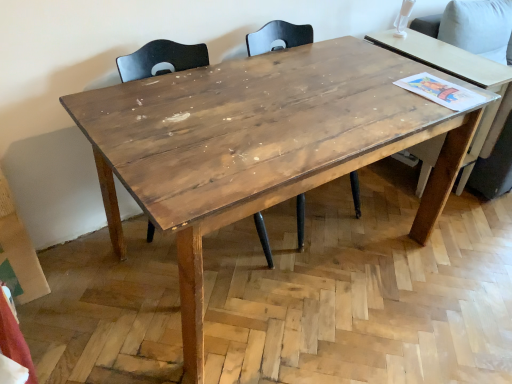
Describe the element at coordinates (459, 78) in the screenshot. I see `wooden table at right` at that location.

At what (x,y) coordinates should I click in order to perform the action: click on wooden chair at center, arranged as the 1th chair when viewed from the left. Please return your answer as a coordinate pair (x, y). The width and height of the screenshot is (512, 384). Looking at the image, I should click on (161, 59).

Considering the relative positions of wooden table at right and wooden chair at center, which appears as the second chair when viewed from the right, in the image provided, is wooden table at right to the right of wooden chair at center, which appears as the second chair when viewed from the right, from the viewer's perspective?

Indeed, wooden table at right is positioned on the right side of wooden chair at center, which appears as the second chair when viewed from the right.

Considering the relative sizes of wooden table at right and wooden chair at center, arranged as the 1th chair when viewed from the left, in the image provided, is wooden table at right bigger than wooden chair at center, arranged as the 1th chair when viewed from the left,?

Indeed, wooden table at right has a larger size compared to wooden chair at center, arranged as the 1th chair when viewed from the left.

Is wooden table at right oriented away from wooden chair at center, which appears as the second chair when viewed from the right?

No, wooden chair at center, which appears as the second chair when viewed from the right, is not at the back of wooden table at right.

Is wooden chair at center, which appears as the second chair when viewed from the right, completely or partially inside wooden table at right?

No, wooden chair at center, which appears as the second chair when viewed from the right, is not inside wooden table at right.

What's the angular difference between wooden chair at center, which is the first chair in right-to-left order, and wooden table at right's facing directions?

2.31 degrees.

Would you say wooden chair at center, which is the first chair in right-to-left order, is outside wooden table at right?

wooden chair at center, which is the first chair in right-to-left order, is positioned outside wooden table at right.

Does wooden chair at center, marked as the second chair in a left-to-right arrangement, turn towards wooden table at right?

No, wooden chair at center, marked as the second chair in a left-to-right arrangement, is not turned towards wooden table at right.

Is wooden chair at center, marked as the second chair in a left-to-right arrangement, shorter than wooden table at right?

Yes.

Could you tell me if wooden chair at center, which appears as the second chair when viewed from the right, is turned towards wooden chair at center, marked as the second chair in a left-to-right arrangement?

No.

Is wooden chair at center, marked as the second chair in a left-to-right arrangement, surrounded by wooden chair at center, arranged as the 1th chair when viewed from the left?

Definitely not — wooden chair at center, marked as the second chair in a left-to-right arrangement, is not inside wooden chair at center, arranged as the 1th chair when viewed from the left.

Looking at this image, from the image's perspective, which object appears higher, wooden chair at center, which appears as the second chair when viewed from the right, or wooden chair at center, marked as the second chair in a left-to-right arrangement?

wooden chair at center, marked as the second chair in a left-to-right arrangement, appears higher in the image.

The height and width of the screenshot is (384, 512). Find the location of `chair in front of the wooden chair at center, which is the first chair in right-to-left order`. chair in front of the wooden chair at center, which is the first chair in right-to-left order is located at coordinates (161, 59).

Is wooden chair at center, marked as the second chair in a left-to-right arrangement, not near wooden chair at center, arranged as the 1th chair when viewed from the left?

No, wooden chair at center, marked as the second chair in a left-to-right arrangement, is not far from wooden chair at center, arranged as the 1th chair when viewed from the left.

Which of these two, wooden chair at center, which is the first chair in right-to-left order, or wooden chair at center, which appears as the second chair when viewed from the right, stands shorter?

wooden chair at center, which is the first chair in right-to-left order, is shorter.

Based on the photo, is wooden chair at center, which is the first chair in right-to-left order, facing towards wooden chair at center, arranged as the 1th chair when viewed from the left?

No, wooden chair at center, which is the first chair in right-to-left order, is not oriented towards wooden chair at center, arranged as the 1th chair when viewed from the left.

Would you say wooden chair at center, which appears as the second chair when viewed from the right, is inside or outside wooden table at right?

wooden chair at center, which appears as the second chair when viewed from the right, is not enclosed by wooden table at right.

Where is `table behind the wooden chair at center, which appears as the second chair when viewed from the right`? The image size is (512, 384). table behind the wooden chair at center, which appears as the second chair when viewed from the right is located at coordinates (459, 78).

From a real-world perspective, between wooden chair at center, which appears as the second chair when viewed from the right, and wooden table at right, who is vertically higher?

In real-world perspective, wooden table at right is above.

How many degrees apart are the facing directions of wooden chair at center, which appears as the second chair when viewed from the right, and wooden table at right?

The angular difference between wooden chair at center, which appears as the second chair when viewed from the right, and wooden table at right is 2.31 degrees.

Are wooden table at right and wooden chair at center, which is the first chair in right-to-left order, beside each other?

No, wooden table at right is not beside wooden chair at center, which is the first chair in right-to-left order.

Which object is further away from the camera, wooden table at right or wooden chair at center, which is the first chair in right-to-left order?

wooden table at right is further from the camera.

Between wooden table at right and wooden chair at center, marked as the second chair in a left-to-right arrangement, which one appears on the right side from the viewer's perspective?

From the viewer's perspective, wooden table at right appears more on the right side.

At what (x,y) coordinates should I click in order to perform the action: click on table above the wooden chair at center, arranged as the 1th chair when viewed from the left (from the image's perspective). Please return your answer as a coordinate pair (x, y). This screenshot has width=512, height=384. Looking at the image, I should click on (459, 78).

This screenshot has height=384, width=512. Find the location of `the 1st chair below the wooden table at right (from the image's perspective)`. the 1st chair below the wooden table at right (from the image's perspective) is located at coordinates (278, 37).

Considering their positions, is wooden chair at center, marked as the second chair in a left-to-right arrangement, positioned closer to wooden chair at center, arranged as the 1th chair when viewed from the left, than wooden table at right?

Among the two, wooden chair at center, marked as the second chair in a left-to-right arrangement, is located nearer to wooden chair at center, arranged as the 1th chair when viewed from the left.

Looking at the image, which one is located closer to wooden chair at center, marked as the second chair in a left-to-right arrangement, wooden table at right or wooden chair at center, which appears as the second chair when viewed from the right?

The object closer to wooden chair at center, marked as the second chair in a left-to-right arrangement, is wooden chair at center, which appears as the second chair when viewed from the right.

When comparing their distances from wooden chair at center, arranged as the 1th chair when viewed from the left, does wooden table at right or wooden chair at center, marked as the second chair in a left-to-right arrangement, seem further?

wooden table at right.

Based on their spatial positions, is wooden chair at center, arranged as the 1th chair when viewed from the left, or wooden chair at center, which is the first chair in right-to-left order, further from wooden table at right?

wooden chair at center, arranged as the 1th chair when viewed from the left, lies further to wooden table at right than the other object.

Considering their positions, is wooden chair at center, which is the first chair in right-to-left order, positioned closer to wooden table at right than wooden chair at center, arranged as the 1th chair when viewed from the left?

wooden chair at center, which is the first chair in right-to-left order, is closer to wooden table at right.

Based on the photo, considering their positions, is wooden chair at center, arranged as the 1th chair when viewed from the left, positioned further to wooden chair at center, which is the first chair in right-to-left order, than wooden table at right?

wooden table at right.

Image resolution: width=512 pixels, height=384 pixels. In order to click on chair between wooden chair at center, which appears as the second chair when viewed from the right, and wooden table at right in this screenshot , I will do `click(278, 37)`.